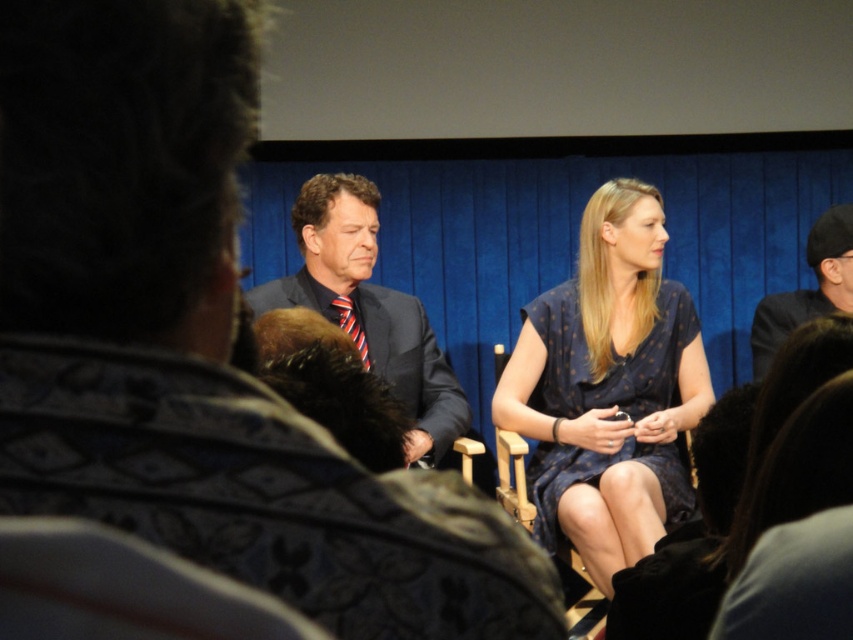
You are an event organizer who needs to arrange a photo shoot for the seated panelists. The photographer wants to ensure that the blue dotted dress at center and the matte black suit at left are both visible in the frame. Based on their positions, which one should be placed closer to the camera to ensure both are in focus?

The blue dotted dress at center is located below the matte black suit at left, so to ensure both are in focus, the matte black suit at left should be placed closer to the camera since it is higher up and the blue dotted dress at center is positioned lower.

You are an event organizer who needs to seat two speakers. You have two chairs available. The dark blue suit at center is currently seated in a chair that can only hold up to 30 cm in width. The dark gray suit at right is in a chair that can hold up to 40 cm. Based on their suits, will both speakers fit comfortably in their respective chairs?

The dark blue suit at center is thinner than the dark gray suit at right. Since the dark blue suit at center is in a 30 cm chair and the dark gray suit at right is in a 40 cm chair, both should fit comfortably as their suit widths are within the chair capacities.

You are attending a conference and need to sit down. You see a dark gray suit at right and a wooden chair at center. Which object is shorter, and can you sit on it?

The dark gray suit at right is shorter than the wooden chair at center. However, the dark gray suit at right is an article of clothing and not a seat, so you cannot sit on it.